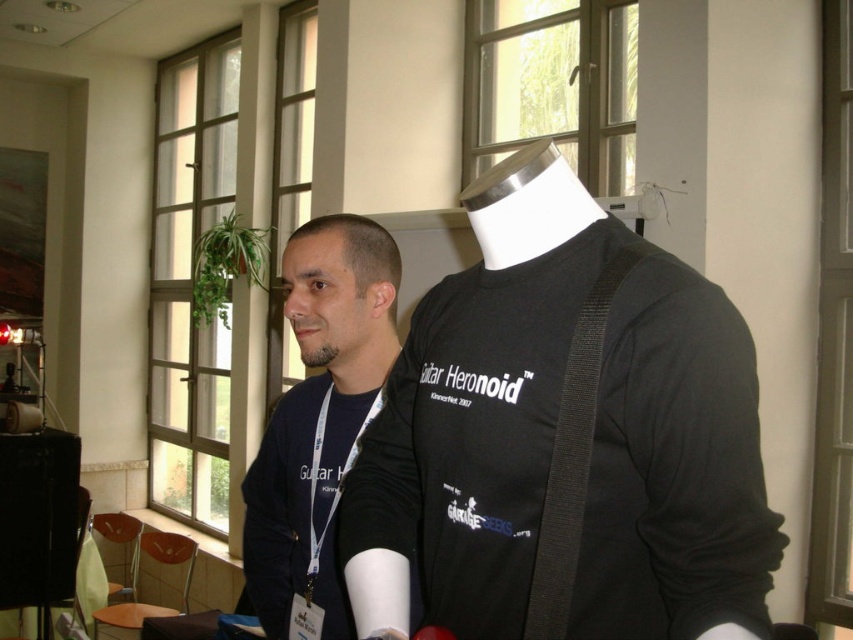
Is point (751, 440) positioned in front of point (395, 273)?

Yes, point (751, 440) is in front of point (395, 273).

Is black matte shirt at center shorter than matte black shirt at center?

Indeed, black matte shirt at center has a lesser height compared to matte black shirt at center.

Where is `black matte shirt at center`? The height and width of the screenshot is (640, 853). black matte shirt at center is located at coordinates (564, 438).